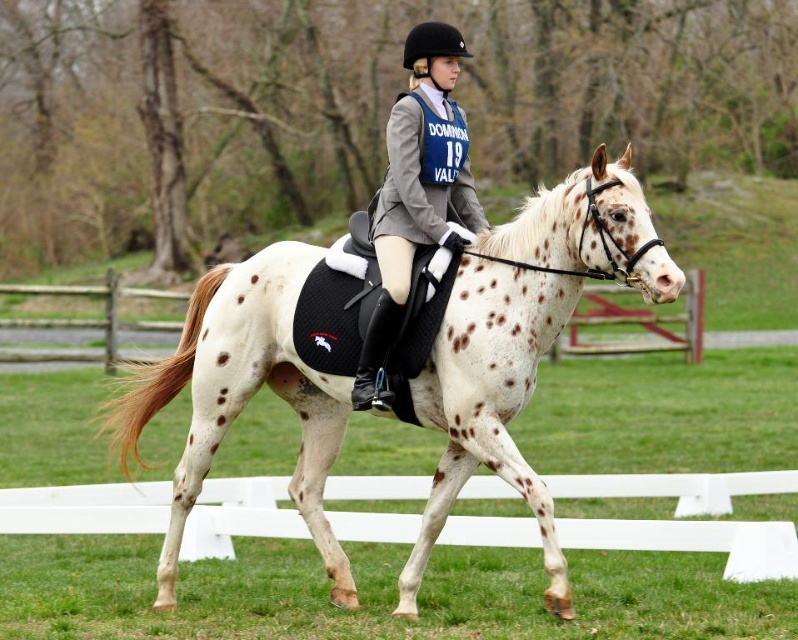
Question: Which point is farther to the camera?

Choices:
 (A) speckled white horse at center
 (B) matte gray jacket at center

Answer: (A)

Question: Is speckled white horse at center below matte gray jacket at center?

Choices:
 (A) yes
 (B) no

Answer: (A)

Question: Can you confirm if speckled white horse at center is positioned to the left of matte gray jacket at center?

Choices:
 (A) yes
 (B) no

Answer: (A)

Question: Which point appears farthest from the camera in this image?

Choices:
 (A) (389, 211)
 (B) (473, 445)

Answer: (A)

Question: In this image, where is speckled white horse at center located relative to matte gray jacket at center?

Choices:
 (A) above
 (B) below

Answer: (B)